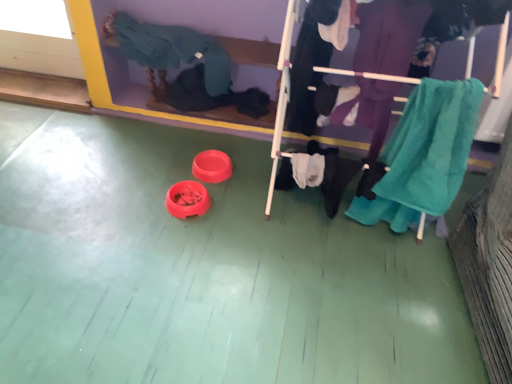
Question: Is teal fabric clothes rack at center a part of black cotton pants at center, which is counted as the 2th clothing, starting from the left?

Choices:
 (A) yes
 (B) no

Answer: (B)

Question: From a real-world perspective, is black cotton pants at center, marked as the 2th clothing in a right-to-left arrangement, on teal fabric clothes rack at center?

Choices:
 (A) no
 (B) yes

Answer: (A)

Question: Is teal fabric clothes rack at center at the back of black cotton pants at center, marked as the 2th clothing in a right-to-left arrangement?

Choices:
 (A) yes
 (B) no

Answer: (A)

Question: Are black cotton pants at center, which is counted as the 2th clothing, starting from the left, and teal fabric clothes rack at center beside each other?

Choices:
 (A) yes
 (B) no

Answer: (B)

Question: Does black cotton pants at center, which is counted as the 2th clothing, starting from the left, lie behind teal fabric clothes rack at center?

Choices:
 (A) no
 (B) yes

Answer: (B)

Question: Is black cotton pants at center, which is counted as the 2th clothing, starting from the left, facing towards teal fabric clothes rack at center?

Choices:
 (A) no
 (B) yes

Answer: (B)

Question: Is knitted teal sweater at upper left, the third clothing from the right, touching teal fabric clothes rack at center?

Choices:
 (A) yes
 (B) no

Answer: (B)

Question: Is knitted teal sweater at upper left, which ranks as the 1th clothing in left-to-right order, far away from teal fabric clothes rack at center?

Choices:
 (A) yes
 (B) no

Answer: (B)

Question: Is knitted teal sweater at upper left, which ranks as the 1th clothing in left-to-right order, bigger than teal fabric clothes rack at center?

Choices:
 (A) yes
 (B) no

Answer: (B)

Question: Is knitted teal sweater at upper left, which ranks as the 1th clothing in left-to-right order, facing away from teal fabric clothes rack at center?

Choices:
 (A) no
 (B) yes

Answer: (A)

Question: Is the position of knitted teal sweater at upper left, the third clothing from the right, more distant than that of teal fabric clothes rack at center?

Choices:
 (A) yes
 (B) no

Answer: (A)

Question: Considering the relative positions of knitted teal sweater at upper left, the third clothing from the right, and teal fabric clothes rack at center in the image provided, is knitted teal sweater at upper left, the third clothing from the right, to the left of teal fabric clothes rack at center from the viewer's perspective?

Choices:
 (A) no
 (B) yes

Answer: (B)

Question: Is the position of teal fabric clothes rack at center more distant than that of teal towel at right, the third clothing viewed from the left?

Choices:
 (A) no
 (B) yes

Answer: (A)